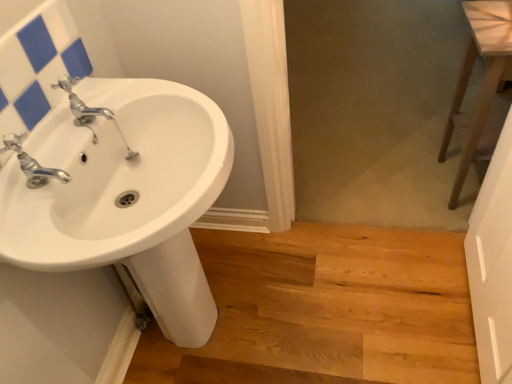
Identify the location of vacant region under white glossy sink at left (from a real-world perspective). This screenshot has width=512, height=384. (214, 333).